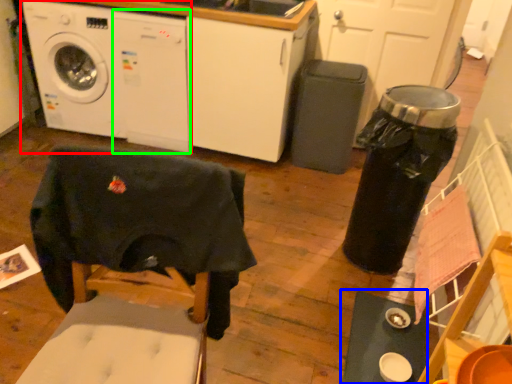
Question: Which object is the closest to the washing machine (highlighted by a red box)? Choose among these: table (highlighted by a blue box) or washing machine (highlighted by a green box).

Choices:
 (A) table
 (B) washing machine

Answer: (B)